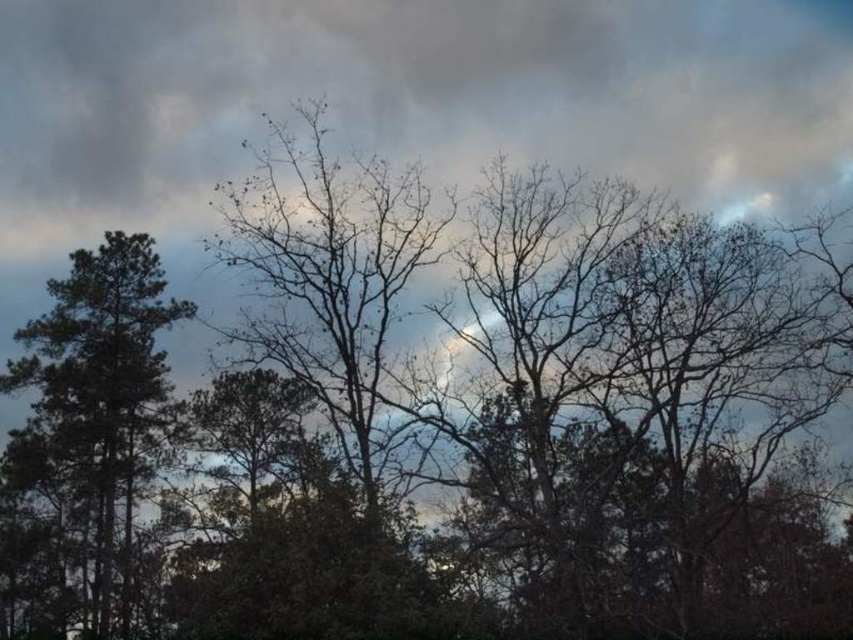
Question: Which object is farther from the camera taking this photo?

Choices:
 (A) green matte tree at left
 (B) bare branches at center

Answer: (A)

Question: Can you confirm if bare branches at center is thinner than green matte tree at left?

Choices:
 (A) yes
 (B) no

Answer: (B)

Question: Which point is farther to the camera?

Choices:
 (A) green matte tree at left
 (B) bare branches at center

Answer: (A)

Question: In this image, where is bare branches at center located relative to green matte tree at left?

Choices:
 (A) left
 (B) right

Answer: (B)

Question: Is the position of bare branches at center less distant than that of green matte tree at left?

Choices:
 (A) no
 (B) yes

Answer: (B)